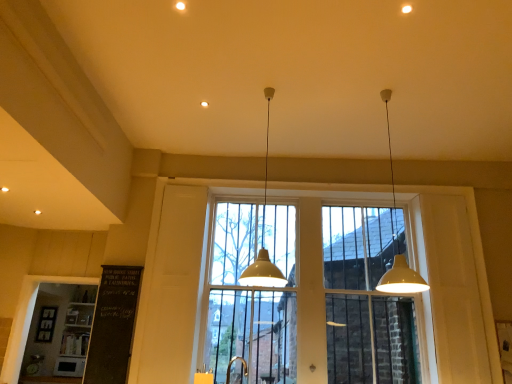
What do you see at coordinates (29, 320) in the screenshot?
I see `white wood window frame at lower left` at bounding box center [29, 320].

What is the approximate height of white matte pendant light at upper right, acting as the second lamp starting from the left?

It is 5.70 feet.

Where is `white wood window frame at lower left`? white wood window frame at lower left is located at coordinates (29, 320).

Which is farther from the camera, (375, 276) or (15, 336)?

The point (15, 336) is behind.

From a real-world perspective, which is physically above, clear glass window at center or white wood window frame at lower left?

In real-world perspective, clear glass window at center is above.

Looking at this image, can we say clear glass window at center lies outside white wood window frame at lower left?

Yes, clear glass window at center is outside of white wood window frame at lower left.

From a real-world perspective, is clear glass window at center beneath gold metallic faucet at lower center?

No, from a real-world perspective, clear glass window at center is not below gold metallic faucet at lower center.

Could gold metallic faucet at lower center be considered to be inside clear glass window at center?

Definitely not — gold metallic faucet at lower center is not inside clear glass window at center.

Considering their positions, is clear glass window at center located in front of or behind gold metallic faucet at lower center?

Clearly, clear glass window at center is behind gold metallic faucet at lower center.

From the image's perspective, relative to gold metallic faucet at lower center, is clear glass window at center above or below?

From the image's perspective, clear glass window at center appears above gold metallic faucet at lower center.

Does white wood window frame at lower left have a greater width compared to white matte pendant light at upper right, acting as the second lamp starting from the left?

No.

Choose the correct answer: Is white wood window frame at lower left inside white matte pendant light at upper right, which appears as the 1th lamp when viewed from the right, or outside it?

white wood window frame at lower left is not enclosed by white matte pendant light at upper right, which appears as the 1th lamp when viewed from the right.

Is white wood window frame at lower left facing towards white matte pendant light at upper right, acting as the second lamp starting from the left?

No, white wood window frame at lower left is not aimed at white matte pendant light at upper right, acting as the second lamp starting from the left.

From the image's perspective, is white wood window frame at lower left positioned above or below white matte pendant light at upper right, acting as the second lamp starting from the left?

white wood window frame at lower left is below white matte pendant light at upper right, acting as the second lamp starting from the left.

Considering the relative sizes of clear glass window at center and white matte pendant light at center, which ranks as the 1th lamp in left-to-right order, in the image provided, is clear glass window at center wider than white matte pendant light at center, which ranks as the 1th lamp in left-to-right order,?

No, clear glass window at center is not wider than white matte pendant light at center, which ranks as the 1th lamp in left-to-right order.

From a real-world perspective, who is located higher, clear glass window at center or white matte pendant light at center, which is counted as the 2th lamp, starting from the right?

white matte pendant light at center, which is counted as the 2th lamp, starting from the right, is physically above.

Considering the sizes of clear glass window at center and white matte pendant light at center, which is counted as the 2th lamp, starting from the right, in the image, is clear glass window at center bigger or smaller than white matte pendant light at center, which is counted as the 2th lamp, starting from the right,?

Clearly, clear glass window at center is larger in size than white matte pendant light at center, which is counted as the 2th lamp, starting from the right.

Is clear glass window at center further to camera compared to white matte pendant light at center, which is counted as the 2th lamp, starting from the right?

Yes, the depth of clear glass window at center is greater than that of white matte pendant light at center, which is counted as the 2th lamp, starting from the right.

Between clear glass window at center and white matte pendant light at upper right, acting as the second lamp starting from the left, which one has smaller size?

white matte pendant light at upper right, acting as the second lamp starting from the left, is smaller.

Does point (383, 359) lie behind point (395, 209)?

No.

From a real-world perspective, is clear glass window at center physically below white matte pendant light at upper right, which appears as the 1th lamp when viewed from the right?

Yes.

Could you tell me if clear glass window at center is turned towards white matte pendant light at upper right, which appears as the 1th lamp when viewed from the right?

Yes, clear glass window at center faces towards white matte pendant light at upper right, which appears as the 1th lamp when viewed from the right.

Does white matte pendant light at center, which is counted as the 2th lamp, starting from the right, have a larger size compared to white matte pendant light at upper right, acting as the second lamp starting from the left?

Incorrect, white matte pendant light at center, which is counted as the 2th lamp, starting from the right, is not larger than white matte pendant light at upper right, acting as the second lamp starting from the left.

Is white matte pendant light at center, which is counted as the 2th lamp, starting from the right, next to white matte pendant light at upper right, acting as the second lamp starting from the left, and touching it?

white matte pendant light at center, which is counted as the 2th lamp, starting from the right, and white matte pendant light at upper right, acting as the second lamp starting from the left, are not in contact.

Which is closer, (274, 265) or (391, 150)?

The point (391, 150) is closer to the camera.

Between white matte pendant light at center, which is counted as the 2th lamp, starting from the right, and white matte pendant light at upper right, acting as the second lamp starting from the left, which one has larger width?

Wider between the two is white matte pendant light at upper right, acting as the second lamp starting from the left.

From a real-world perspective, relative to clear glass window at center, is white matte pendant light at center, which is counted as the 2th lamp, starting from the right, vertically above or below?

From a real-world perspective, white matte pendant light at center, which is counted as the 2th lamp, starting from the right, is physically above clear glass window at center.

Between white matte pendant light at center, which ranks as the 1th lamp in left-to-right order, and clear glass window at center, which one has smaller size?

With smaller size is white matte pendant light at center, which ranks as the 1th lamp in left-to-right order.

From the image's perspective, is white matte pendant light at center, which is counted as the 2th lamp, starting from the right, beneath clear glass window at center?

Actually, white matte pendant light at center, which is counted as the 2th lamp, starting from the right, appears above clear glass window at center in the image.

Are white matte pendant light at center, which is counted as the 2th lamp, starting from the right, and clear glass window at center making contact?

No, white matte pendant light at center, which is counted as the 2th lamp, starting from the right, is not with clear glass window at center.

You are a GUI agent. You are given a task and a screenshot of the screen. Output one action in this format:
    pyautogui.click(x=<x>, y=<y>)
    Task: Click on the window frame behind the clear glass window at center
    Image resolution: width=512 pixels, height=384 pixels.
    Given the screenshot: What is the action you would take?
    pyautogui.click(x=29, y=320)

This screenshot has width=512, height=384. I want to click on window on the right of gold metallic faucet at lower center, so point(335,301).

Based on the photo, estimate the real-world distances between objects in this image. Which object is further from clear glass window at center, white wood window frame at lower left or gold metallic faucet at lower center?

white wood window frame at lower left.

Which object lies further to the anchor point white matte pendant light at upper right, acting as the second lamp starting from the left, white matte pendant light at center, which is counted as the 2th lamp, starting from the right, or gold metallic faucet at lower center?

Among the two, gold metallic faucet at lower center is located further to white matte pendant light at upper right, acting as the second lamp starting from the left.

From the image, which object appears to be farther from white wood window frame at lower left, clear glass window at center or white matte pendant light at center, which is counted as the 2th lamp, starting from the right?

Based on the image, white matte pendant light at center, which is counted as the 2th lamp, starting from the right, appears to be further to white wood window frame at lower left.

Considering their positions, is white matte pendant light at upper right, acting as the second lamp starting from the left, positioned closer to white wood window frame at lower left than gold metallic faucet at lower center?

gold metallic faucet at lower center is closer to white wood window frame at lower left.

Looking at the image, which one is located closer to white matte pendant light at center, which is counted as the 2th lamp, starting from the right, white matte pendant light at upper right, which appears as the 1th lamp when viewed from the right, or clear glass window at center?

white matte pendant light at upper right, which appears as the 1th lamp when viewed from the right, is positioned closer to the anchor white matte pendant light at center, which is counted as the 2th lamp, starting from the right.

Based on their spatial positions, is white matte pendant light at upper right, acting as the second lamp starting from the left, or gold metallic faucet at lower center further from clear glass window at center?

white matte pendant light at upper right, acting as the second lamp starting from the left, lies further to clear glass window at center than the other object.

Based on their spatial positions, is white wood window frame at lower left or white matte pendant light at center, which is counted as the 2th lamp, starting from the right, closer to white matte pendant light at upper right, which appears as the 1th lamp when viewed from the right?

white matte pendant light at center, which is counted as the 2th lamp, starting from the right, lies closer to white matte pendant light at upper right, which appears as the 1th lamp when viewed from the right, than the other object.

Based on the photo, estimate the real-world distances between objects in this image. Which object is further from white matte pendant light at upper right, acting as the second lamp starting from the left, gold metallic faucet at lower center or white matte pendant light at center, which is counted as the 2th lamp, starting from the right?

gold metallic faucet at lower center.

Identify the location of faucet between white wood window frame at lower left and clear glass window at center. The height and width of the screenshot is (384, 512). (231, 365).

You are a GUI agent. You are given a task and a screenshot of the screen. Output one action in this format:
    pyautogui.click(x=<x>, y=<y>)
    Task: Click on the lamp positioned between white matte pendant light at upper right, acting as the second lamp starting from the left, and clear glass window at center from near to far
    
    Given the screenshot: What is the action you would take?
    pyautogui.click(x=263, y=235)

Find the location of a particular element. This screenshot has width=512, height=384. faucet situated between white wood window frame at lower left and white matte pendant light at center, which ranks as the 1th lamp in left-to-right order, from left to right is located at coordinates (231, 365).

At what (x,y) coordinates should I click in order to perform the action: click on window between white wood window frame at lower left and white matte pendant light at upper right, acting as the second lamp starting from the left. Please return your answer as a coordinate pair (x, y). The width and height of the screenshot is (512, 384). Looking at the image, I should click on (335, 301).